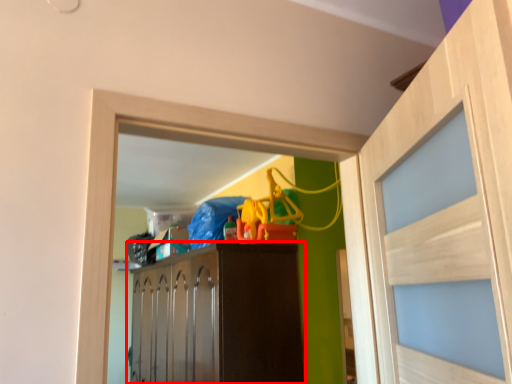
Question: Observing the image, what is the correct spatial positioning of cabinetry (annotated by the red box) in reference to door?

Choices:
 (A) left
 (B) right

Answer: (A)